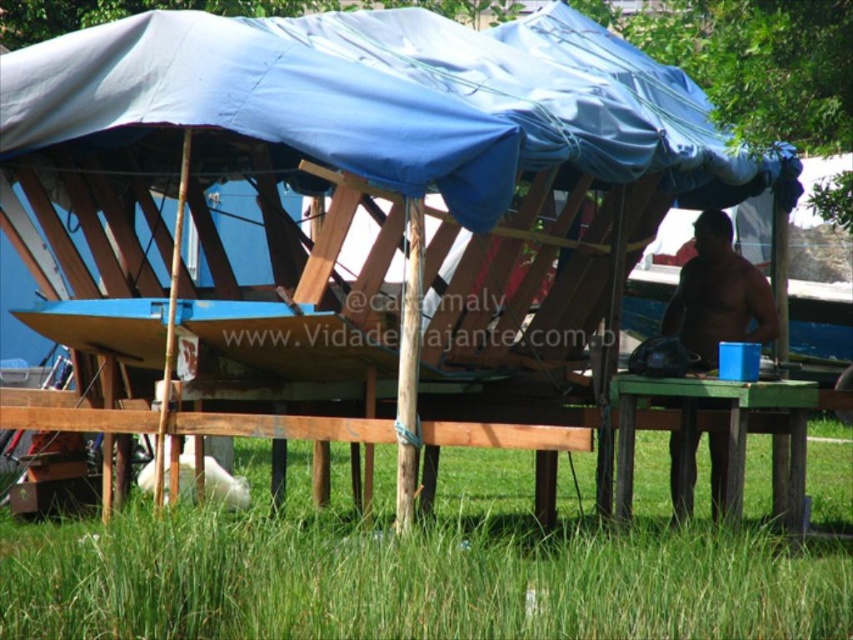
You are standing at the point marked as point [422,568] in the image. Looking around, you see a wooden frame and a blue object under the blue tarp. Which direction should you walk to reach the wooden frame first?

The point [422,568] is on green grass at lower center. Since the wooden frame is under the tarp which is at the lower center, you should walk towards the wooden frame in the direction of the tarp.

You are standing at the point marked by the coordinates point (422, 568) in the image. What is the color of the ground beneath your feet?

The point (422, 568) indicates green grass at lower center, so the ground beneath your feet is green grass.

You are planning to set up a picnic and see the green grass at lower center and the green wooden picnic table at lower right. Which location would be better for shade if you want to avoid direct sunlight?

The green wooden picnic table at lower right is better for shade because it is positioned to the right of the green grass at lower center, which is under the blue tarp providing shade.